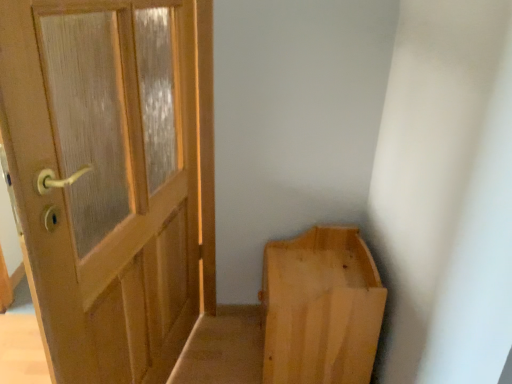
Question: Looking at the image, does matte wood door at left seem bigger or smaller compared to light wood/rough plank bench at lower right?

Choices:
 (A) big
 (B) small

Answer: (A)

Question: From the image's perspective, is matte wood door at left above or below light wood/rough plank bench at lower right?

Choices:
 (A) above
 (B) below

Answer: (A)

Question: Is point (96, 205) positioned closer to the camera than point (353, 253)?

Choices:
 (A) closer
 (B) farther

Answer: (B)

Question: From a real-world perspective, relative to matte wood door at left, is light wood/rough plank bench at lower right vertically above or below?

Choices:
 (A) below
 (B) above

Answer: (A)

Question: From the image's perspective, is light wood/rough plank bench at lower right above or below matte wood door at left?

Choices:
 (A) above
 (B) below

Answer: (B)

Question: Is light wood/rough plank bench at lower right to the left or to the right of matte wood door at left in the image?

Choices:
 (A) right
 (B) left

Answer: (A)

Question: Is light wood/rough plank bench at lower right in front of or behind matte wood door at left in the image?

Choices:
 (A) front
 (B) behind

Answer: (B)